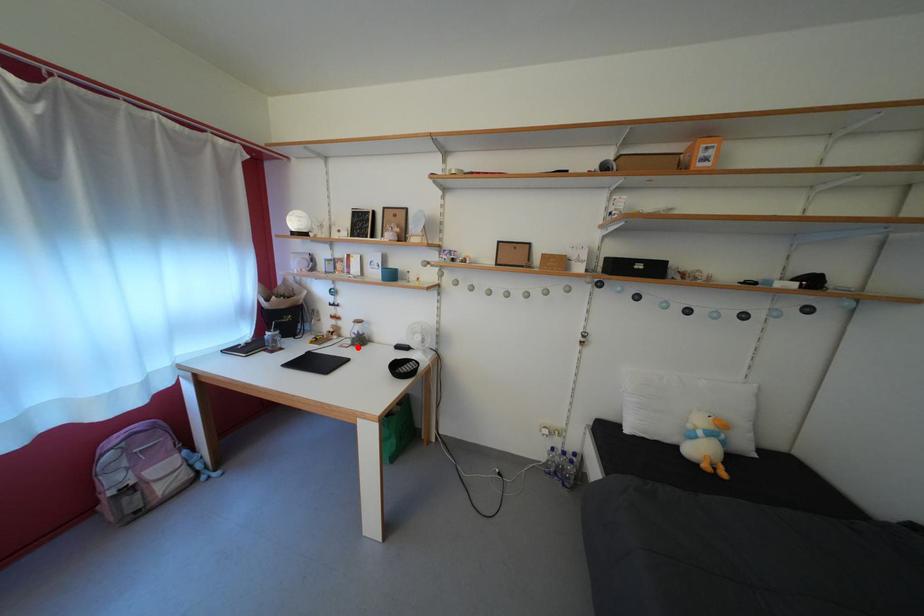
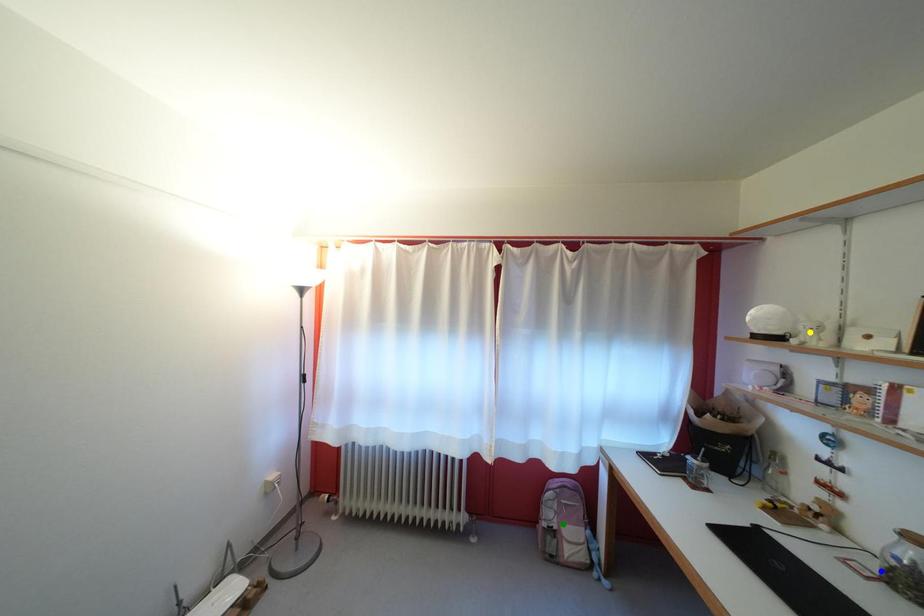
Question: I am providing you with two images of the same scene from different viewpoints. A red point is marked on the first image. You are given multiple points on the second image. Can you choose the point in image 2 that corresponds to the point in image 1?

Choices:
 (A) blue point
 (B) green point
 (C) yellow point

Answer: (A)